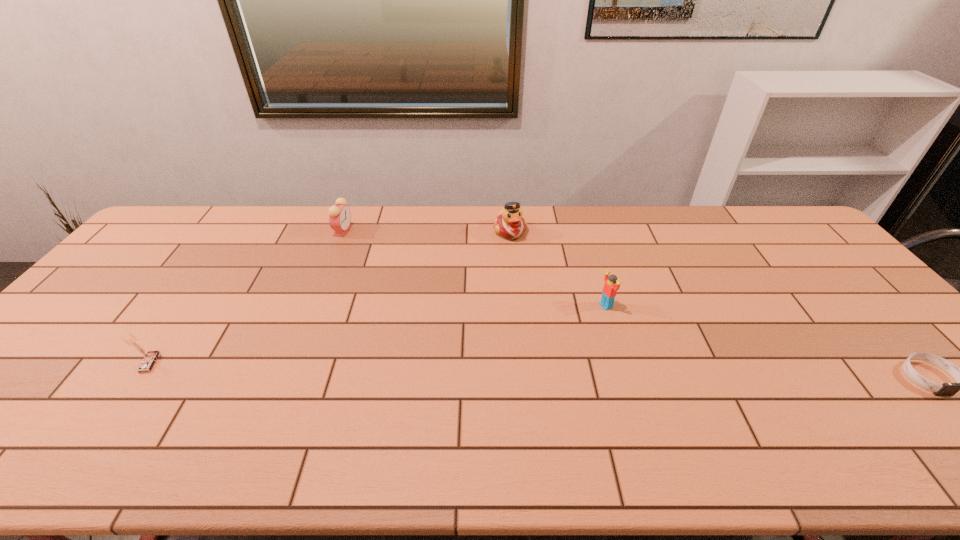
Find the location of `vacant area at the right edge of the desktop`. vacant area at the right edge of the desktop is located at coordinates (927, 366).

Identify the location of free point between the second object from right to left and the matchbox. The height and width of the screenshot is (540, 960). (378, 334).

At what (x,y) coordinates should I click in order to perform the action: click on empty location between the alarm clock and the third object from left to right. Please return your answer as a coordinate pair (x, y). Image resolution: width=960 pixels, height=540 pixels. Looking at the image, I should click on (426, 231).

Where is `free space that is in between the third farthest object and the alarm clock`? The image size is (960, 540). free space that is in between the third farthest object and the alarm clock is located at coordinates (474, 268).

Locate an element on the screen. This screenshot has height=540, width=960. free space between the leftmost object and the third object from right to left is located at coordinates (331, 297).

Find the location of a particular element. free space between the second object from right to left and the fourth object from right to left is located at coordinates (474, 268).

Where is `unoccupied area between the leftmost object and the duck`? unoccupied area between the leftmost object and the duck is located at coordinates (331, 297).

Select which object is the fourth closest to the rightmost object. Please provide its 2D coordinates. Your answer should be formatted as a tuple, i.e. [(x, y)], where the tuple contains the x and y coordinates of a point satisfying the conditions above.

[(149, 357)]

This screenshot has width=960, height=540. What are the coordinates of `object that is the fourth closest one to the matchbox` in the screenshot? It's located at (946, 389).